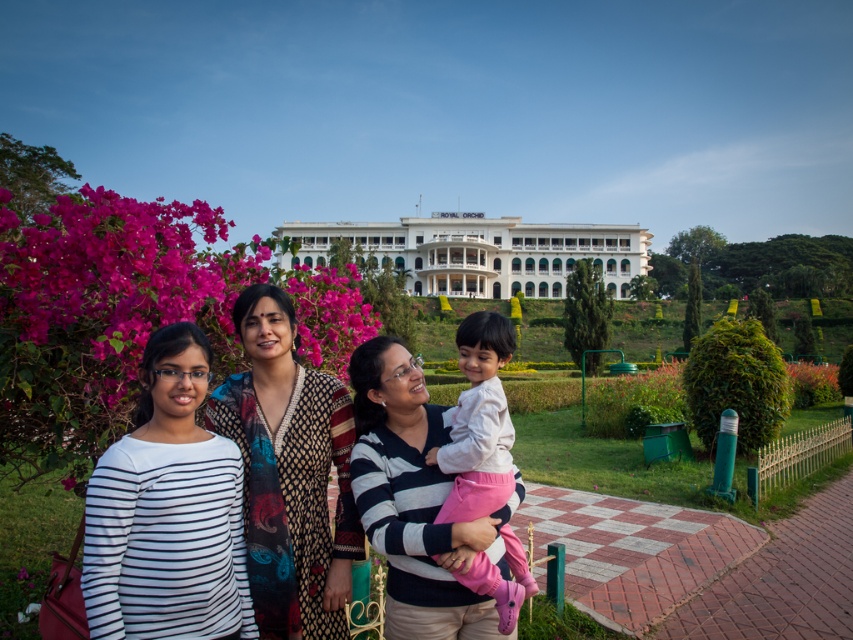
Question: Which point is farther from the camera taking this photo?

Choices:
 (A) (457, 228)
 (B) (427, 458)

Answer: (A)

Question: Is printed silk dress at center thinner than white glossy building at center?

Choices:
 (A) yes
 (B) no

Answer: (A)

Question: Which point is farther to the camera?

Choices:
 (A) (329, 577)
 (B) (172, 236)
 (C) (294, 621)

Answer: (B)

Question: In this image, where is striped cotton shirt at center located relative to white glossy building at center?

Choices:
 (A) left
 (B) right

Answer: (A)

Question: Among these points, which one is farthest from the camera?

Choices:
 (A) (293, 348)
 (B) (505, 218)

Answer: (B)

Question: Can you confirm if striped cotton shirt at center is positioned above light pink fabric at center?

Choices:
 (A) yes
 (B) no

Answer: (B)